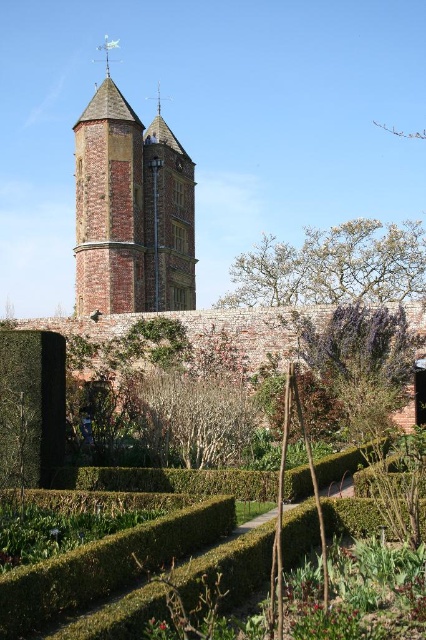
Question: Considering the real-world distances, which object is farthest from the green leafy bush at center?

Choices:
 (A) brick stone bell tower at upper center
 (B) bare wood bush at center

Answer: (A)

Question: Does bare wood bush at center appear over green leafy bush at center?

Choices:
 (A) yes
 (B) no

Answer: (A)

Question: Is bare wood bush at center thinner than green leafy bush at center?

Choices:
 (A) no
 (B) yes

Answer: (A)

Question: Which of these objects is positioned closest to the green leafy bush at center?

Choices:
 (A) brick stone bell tower at upper center
 (B) bare wood bush at center

Answer: (B)

Question: Which point is farther from the camera taking this photo?

Choices:
 (A) (192, 467)
 (B) (282, 380)
 (C) (144, 182)

Answer: (C)

Question: Is bare wood bush at center bigger than green leafy bush at center?

Choices:
 (A) yes
 (B) no

Answer: (A)